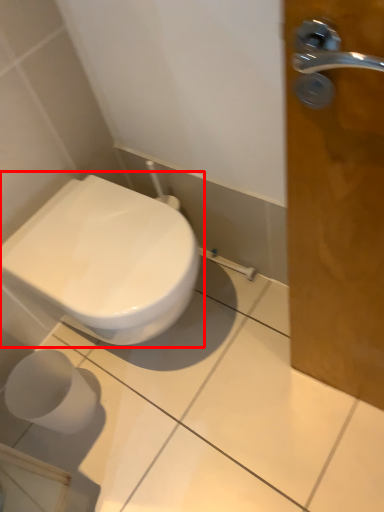
Question: From the image's perspective, where is toilet (annotated by the red box) located in relation to toilet paper in the image?

Choices:
 (A) below
 (B) above

Answer: (B)